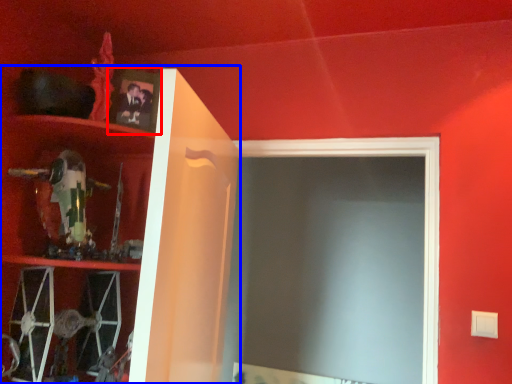
Question: Which point is closer to the camera, picture frame (highlighted by a red box) or cabinet (highlighted by a blue box)?

Choices:
 (A) picture frame
 (B) cabinet

Answer: (B)